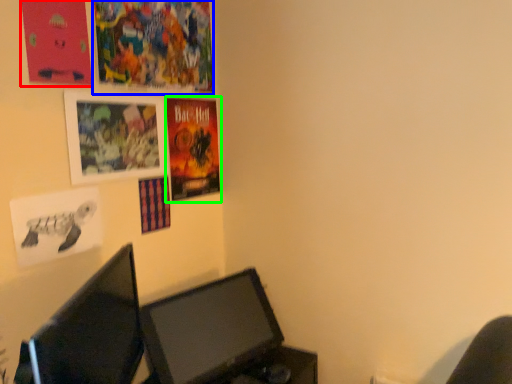
Question: Which object is the closest to the poster page (highlighted by a red box)? Choose among these: poster page (highlighted by a blue box) or poster (highlighted by a green box).

Choices:
 (A) poster page
 (B) poster

Answer: (A)